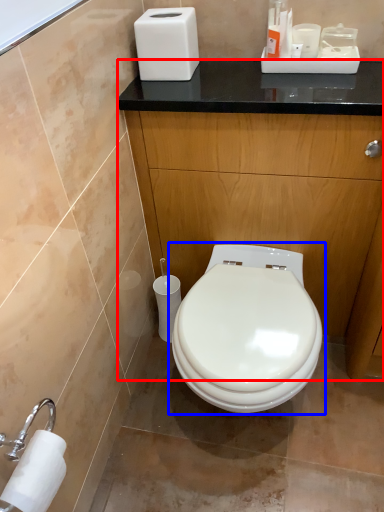
Question: Which object appears closest to the camera in this image, dresser (highlighted by a red box) or toilet (highlighted by a blue box)?

Choices:
 (A) dresser
 (B) toilet

Answer: (B)